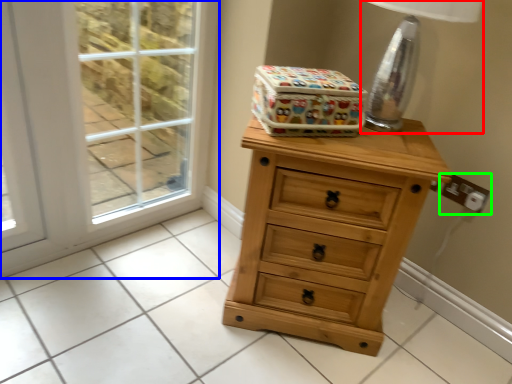
Question: Which is farther away from table lamp (highlighted by a red box)? screen door (highlighted by a blue box) or electric outlet (highlighted by a green box)?

Choices:
 (A) screen door
 (B) electric outlet

Answer: (A)